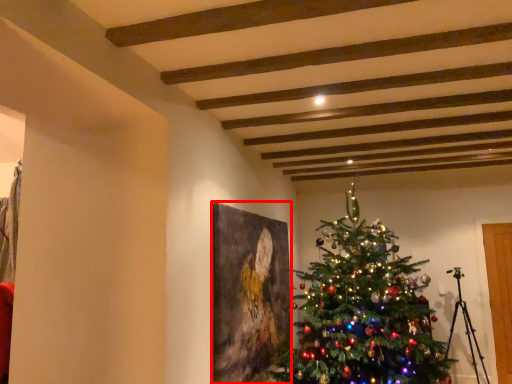
Question: From the image, what is the correct spatial relationship of picture frame (annotated by the red box) in relation to christmas tree?

Choices:
 (A) left
 (B) right

Answer: (A)